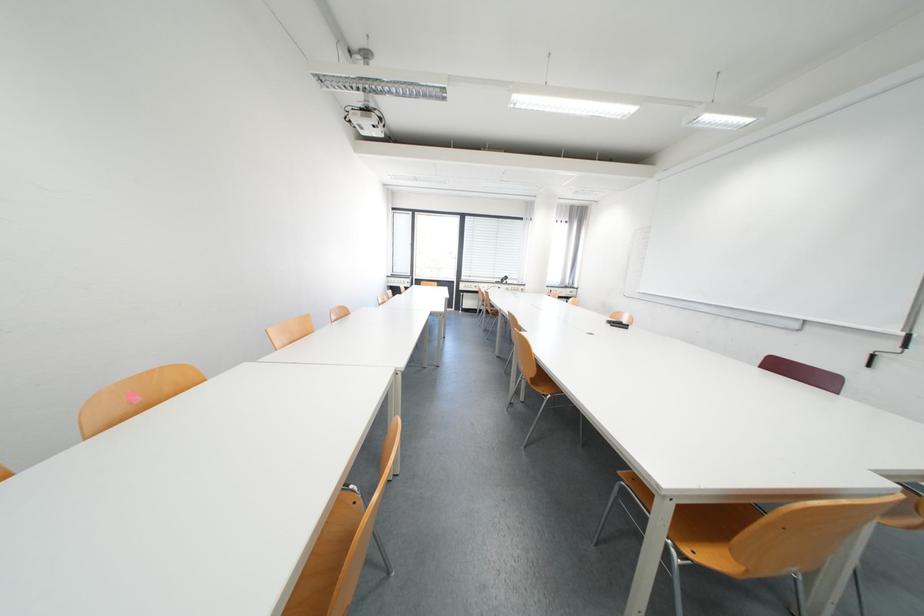
Where would you turn the whiteboard crank handle? Please return your answer as a coordinate pair (x, y).

(889, 350)